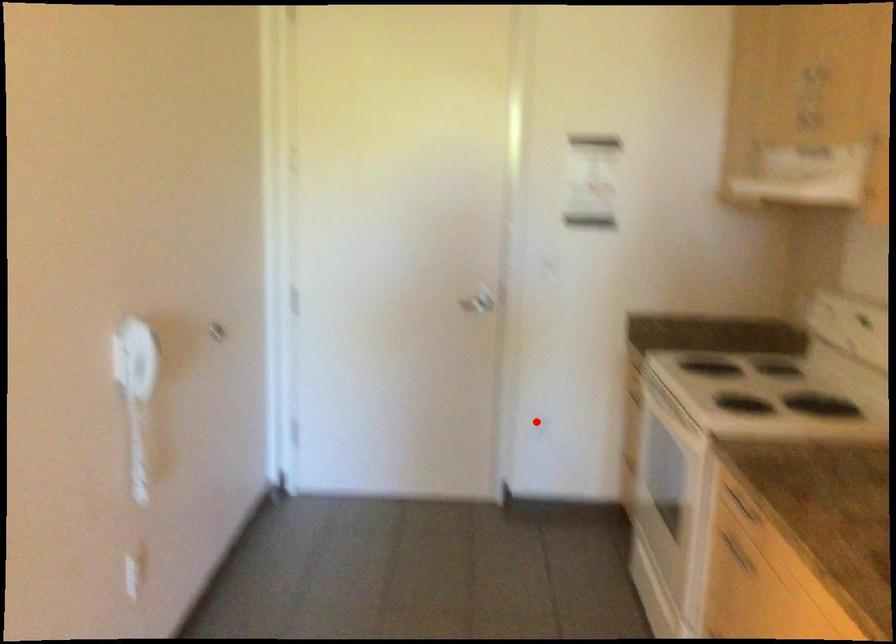
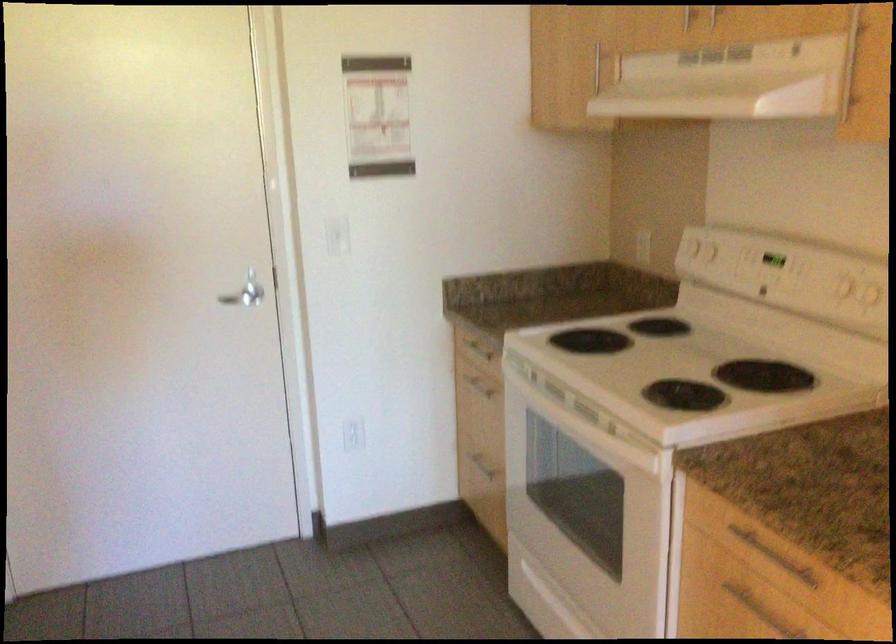
Question: I am providing you with two images of the same scene from different viewpoints. Image1 has a red point marked. In image2, the corresponding 3D location appears at what relative position? Reply with the corresponding letter.

Choices:
 (A) Closer
 (B) Farther

Answer: (A)